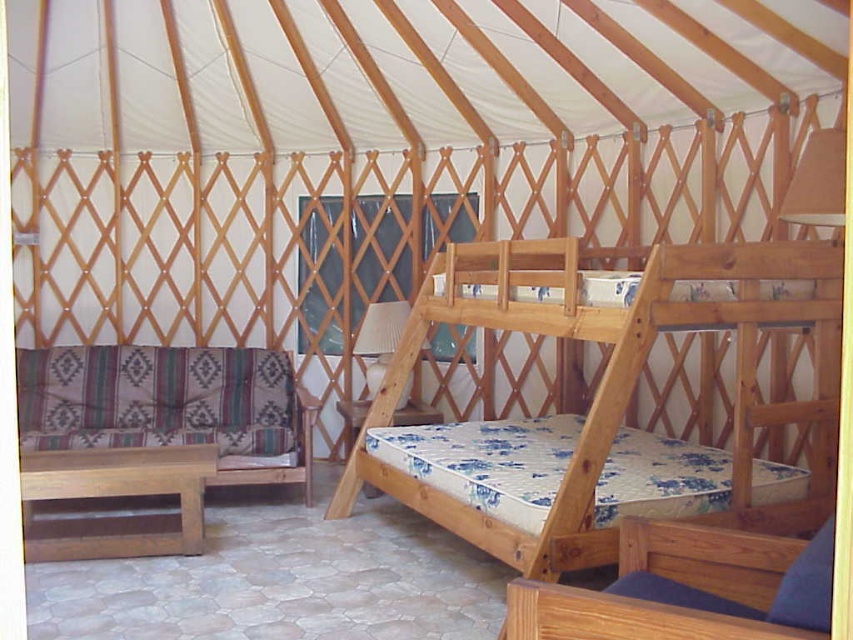
Between point (838, 252) and point (30, 374), which one is positioned in front?

Point (838, 252)

Who is more distant from viewer, (621, 480) or (126, 404)?

Positioned behind is point (126, 404).

Find the location of a particular element. This screenshot has width=853, height=640. natural wood bunk bed at center is located at coordinates (621, 401).